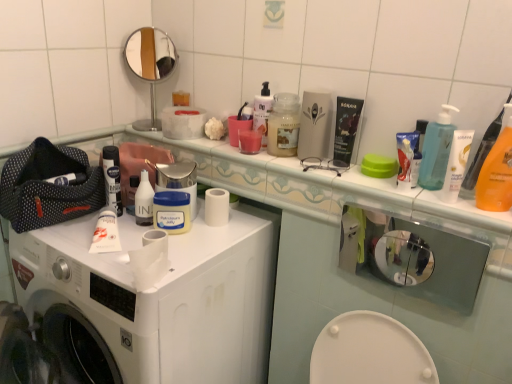
This screenshot has height=384, width=512. I want to click on free area in between white matte toilet paper at center and white matte tube at center, so click(x=118, y=254).